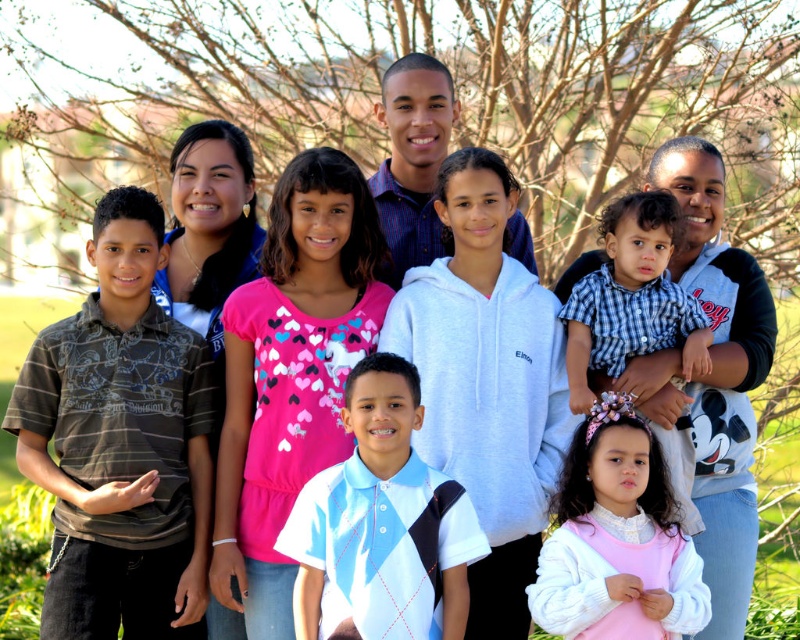
Does white fleece hoodie at upper right appear under checkered fabric shirt at center?

Incorrect, white fleece hoodie at upper right is not positioned below checkered fabric shirt at center.

Describe the element at coordinates (712, 376) in the screenshot. Image resolution: width=800 pixels, height=640 pixels. I see `white fleece hoodie at upper right` at that location.

What are the coordinates of `white fleece hoodie at upper right` in the screenshot? It's located at (712, 376).

Does brown striped polo shirt at left appear on the right side of checkered fabric shirt at center?

No, brown striped polo shirt at left is not to the right of checkered fabric shirt at center.

Consider the image. Which of these two, brown striped polo shirt at left or checkered fabric shirt at center, stands shorter?

Standing shorter between the two is checkered fabric shirt at center.

Identify the location of brown striped polo shirt at left. (120, 444).

The height and width of the screenshot is (640, 800). What are the coordinates of `brown striped polo shirt at left` in the screenshot? It's located at (120, 444).

Between pink velvet dress at lower right and checkered fabric shirt at center, which one has more height?

Standing taller between the two is checkered fabric shirt at center.

Is pink velvet dress at lower right shorter than checkered fabric shirt at center?

Indeed, pink velvet dress at lower right has a lesser height compared to checkered fabric shirt at center.

Find the location of a particular element. pink velvet dress at lower right is located at coordinates (617, 540).